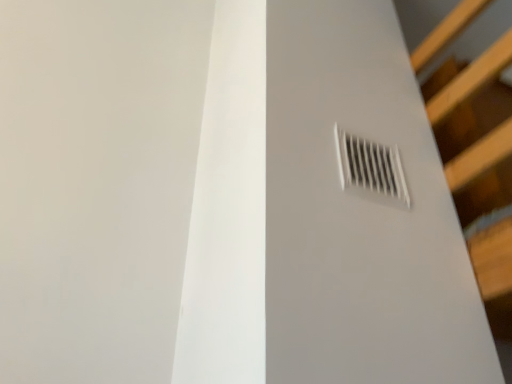
Measure the distance between point (397, 188) and camera.

The distance of point (397, 188) from camera is 35.98 inches.

Where is `white matte vent at upper right`? Image resolution: width=512 pixels, height=384 pixels. white matte vent at upper right is located at coordinates (371, 166).

The height and width of the screenshot is (384, 512). Describe the element at coordinates (371, 166) in the screenshot. I see `white matte vent at upper right` at that location.

Measure the distance between white matte vent at upper right and camera.

A distance of 33.19 inches exists between white matte vent at upper right and camera.

This screenshot has height=384, width=512. Find the location of `white matte vent at upper right`. white matte vent at upper right is located at coordinates click(x=371, y=166).